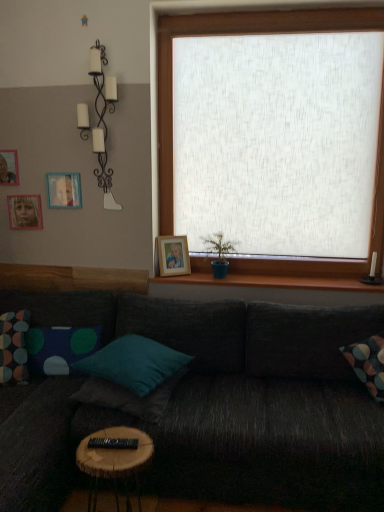
Image resolution: width=384 pixels, height=512 pixels. Find the location of `vacant space in front of wooden picture frame at center, which is the 4th picture frame in left-to-right order`. vacant space in front of wooden picture frame at center, which is the 4th picture frame in left-to-right order is located at coordinates (178, 277).